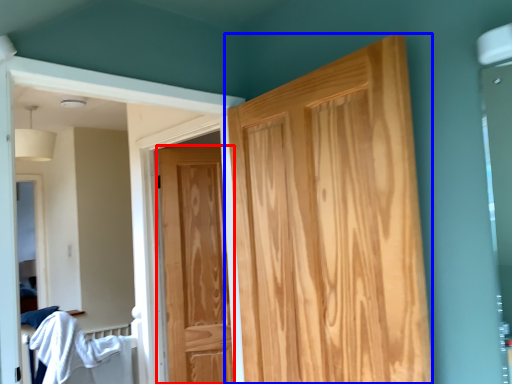
Question: Among these objects, which one is farthest to the camera, door (highlighted by a red box) or door (highlighted by a blue box)?

Choices:
 (A) door
 (B) door

Answer: (A)